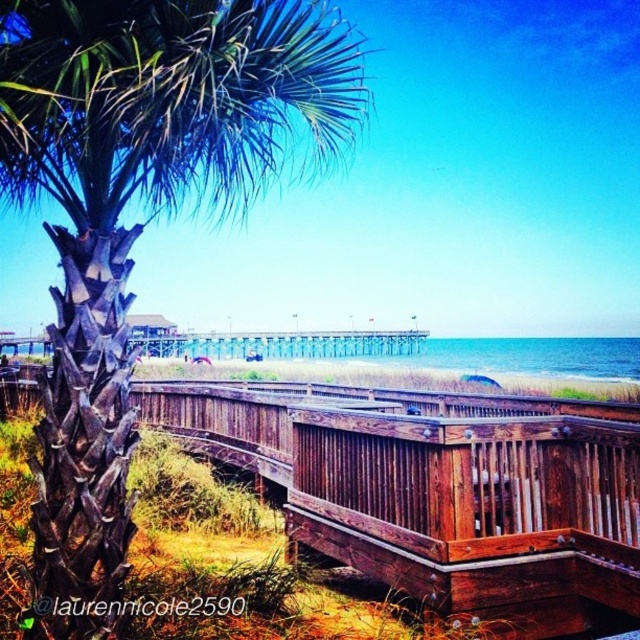
Describe the element at coordinates (147, 218) in the screenshot. I see `dark brown textured palm tree at left` at that location.

Between point (33, 513) and point (566, 372), which one is positioned behind?

The point (566, 372) is more distant.

Is point (348, 26) behind point (456, 368)?

No.

You are a GUI agent. You are given a task and a screenshot of the screen. Output one action in this format:
    pyautogui.click(x=<x>, y=<y>)
    Task: Click on the dark brown textured palm tree at left
    This screenshot has height=640, width=640.
    Given the screenshot: What is the action you would take?
    pyautogui.click(x=147, y=218)

Does dark brown textured palm tree at left have a lesser width compared to brown wooden deck at center?

No.

Which is below, dark brown textured palm tree at left or brown wooden deck at center?

brown wooden deck at center is lower down.

Image resolution: width=640 pixels, height=640 pixels. What are the coordinates of `dark brown textured palm tree at left` in the screenshot? It's located at (147, 218).

Between brown wooden deck at center and blue water at center, which one appears on the right side from the viewer's perspective?

From the viewer's perspective, blue water at center appears more on the right side.

The width and height of the screenshot is (640, 640). In order to click on brown wooden deck at center in this screenshot , I will do `click(440, 490)`.